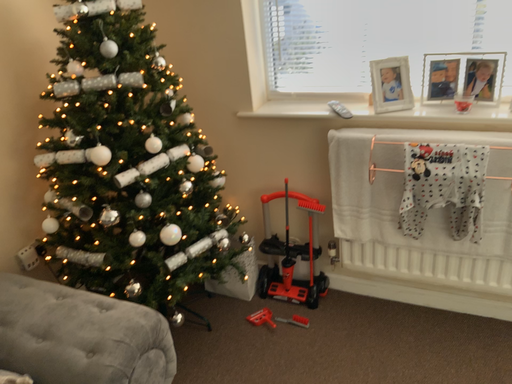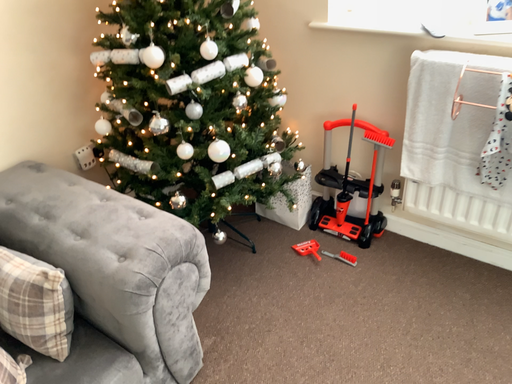
Question: How did the camera likely rotate when shooting the video?

Choices:
 (A) rotated upward
 (B) rotated downward

Answer: (B)